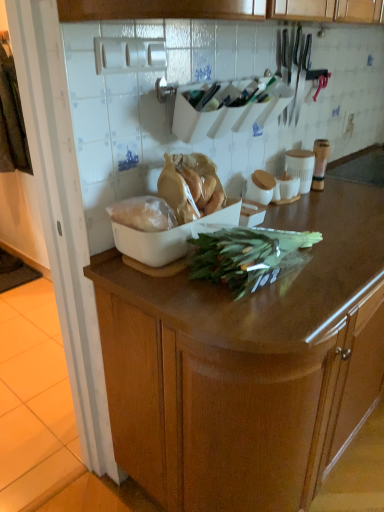
What do you see at coordinates (190, 186) in the screenshot? The width and height of the screenshot is (384, 512). I see `translucent plastic bag at center, the first food when ordered from right to left` at bounding box center [190, 186].

This screenshot has width=384, height=512. What are the coordinates of `green leafy at center` in the screenshot? It's located at (246, 256).

This screenshot has width=384, height=512. What do you see at coordinates (246, 256) in the screenshot? I see `green leafy at center` at bounding box center [246, 256].

Locate an element on the screen. This screenshot has height=512, width=384. white plastic bag at center, which ranks as the 1th food in left-to-right order is located at coordinates (143, 214).

The height and width of the screenshot is (512, 384). What are the coordinates of `wooden cabinet at center` in the screenshot? It's located at (247, 365).

Measure the distance between point (116,314) and camera.

The depth of point (116,314) is 3.71 feet.

Locate an element on the screen. This screenshot has width=384, height=512. translucent plastic bag at center, the first food when ordered from right to left is located at coordinates (190, 186).

What's the angular difference between wooden cabinet at center and translucent plastic bag at center, placed as the 2th food when sorted from left to right,'s facing directions?

There is a 1-degree angle between the facing directions of wooden cabinet at center and translucent plastic bag at center, placed as the 2th food when sorted from left to right.

Can you see wooden cabinet at center touching translucent plastic bag at center, placed as the 2th food when sorted from left to right?

wooden cabinet at center and translucent plastic bag at center, placed as the 2th food when sorted from left to right, are not in contact.

Which object is closer to the camera, wooden cabinet at center or translucent plastic bag at center, placed as the 2th food when sorted from left to right?

wooden cabinet at center is closer to the camera.

Can you confirm if wooden cabinet at center is positioned to the left of translucent plastic bag at center, placed as the 2th food when sorted from left to right?

In fact, wooden cabinet at center is to the right of translucent plastic bag at center, placed as the 2th food when sorted from left to right.

Consider the image. Is green leafy at center turned away from translucent plastic bag at center, placed as the 2th food when sorted from left to right?

Yes, translucent plastic bag at center, placed as the 2th food when sorted from left to right, is at the back of green leafy at center.

Is green leafy at center positioned behind translucent plastic bag at center, placed as the 2th food when sorted from left to right?

No, it is not.

From a real-world perspective, does green leafy at center stand above translucent plastic bag at center, the first food when ordered from right to left?

Incorrect, from a real-world perspective, green leafy at center is lower than translucent plastic bag at center, the first food when ordered from right to left.

Is white plastic bag at center, which ranks as the 1th food in left-to-right order, touching translucent plastic bag at center, placed as the 2th food when sorted from left to right?

Yes, white plastic bag at center, which ranks as the 1th food in left-to-right order, is beside translucent plastic bag at center, placed as the 2th food when sorted from left to right.

Identify the location of food above the white plastic bag at center, which ranks as the 1th food in left-to-right order (from a real-world perspective). (190, 186).

Which point is more distant from viewer, (139,198) or (178,160)?

The point (178,160) is more distant.

Can you confirm if white plastic bag at center, which is the 2th food in right-to-left order, is bigger than translucent plastic bag at center, placed as the 2th food when sorted from left to right?

Actually, white plastic bag at center, which is the 2th food in right-to-left order, might be smaller than translucent plastic bag at center, placed as the 2th food when sorted from left to right.

Is green leafy at center taller than white plastic bag at center, which ranks as the 1th food in left-to-right order?

Indeed, green leafy at center has a greater height compared to white plastic bag at center, which ranks as the 1th food in left-to-right order.

Is the depth of green leafy at center greater than that of white plastic bag at center, which ranks as the 1th food in left-to-right order?

No.

From the picture: Can you confirm if green leafy at center is wider than white plastic bag at center, which ranks as the 1th food in left-to-right order?

Correct, the width of green leafy at center exceeds that of white plastic bag at center, which ranks as the 1th food in left-to-right order.

From the picture: Is green leafy at center outside of white plastic bag at center, which ranks as the 1th food in left-to-right order?

Yes, green leafy at center is outside of white plastic bag at center, which ranks as the 1th food in left-to-right order.

Is translucent plastic bag at center, placed as the 2th food when sorted from left to right, spatially inside white plastic bag at center, which ranks as the 1th food in left-to-right order, or outside of it?

translucent plastic bag at center, placed as the 2th food when sorted from left to right, is located beyond the bounds of white plastic bag at center, which ranks as the 1th food in left-to-right order.

This screenshot has width=384, height=512. What are the coordinates of `food in front of the translucent plastic bag at center, placed as the 2th food when sorted from left to right` in the screenshot? It's located at (143, 214).

Can you confirm if translucent plastic bag at center, placed as the 2th food when sorted from left to right, is positioned to the left of white plastic bag at center, which is the 2th food in right-to-left order?

In fact, translucent plastic bag at center, placed as the 2th food when sorted from left to right, is to the right of white plastic bag at center, which is the 2th food in right-to-left order.

From a real-world perspective, is translucent plastic bag at center, placed as the 2th food when sorted from left to right, positioned above or below white plastic bag at center, which is the 2th food in right-to-left order?

In terms of real-world spatial position, translucent plastic bag at center, placed as the 2th food when sorted from left to right, is above white plastic bag at center, which is the 2th food in right-to-left order.

Is green leafy at center facing away from wooden cabinet at center?

No, green leafy at center is not facing away from wooden cabinet at center.

Does point (310, 241) come in front of point (107, 366)?

That is True.

Can you tell me how much green leafy at center and wooden cabinet at center differ in facing direction?

There is a 0.000624-degree angle between the facing directions of green leafy at center and wooden cabinet at center.

The image size is (384, 512). Find the location of `green vegetables behind the wooden cabinet at center`. green vegetables behind the wooden cabinet at center is located at coordinates (246, 256).

Is white plastic bag at center, which ranks as the 1th food in left-to-right order, located outside wooden cabinet at center?

white plastic bag at center, which ranks as the 1th food in left-to-right order, is positioned outside wooden cabinet at center.

From the image's perspective, is white plastic bag at center, which ranks as the 1th food in left-to-right order, above wooden cabinet at center?

Yes, from the image's perspective, white plastic bag at center, which ranks as the 1th food in left-to-right order, is on top of wooden cabinet at center.

From a real-world perspective, is white plastic bag at center, which ranks as the 1th food in left-to-right order, over wooden cabinet at center?

Yes, from a real-world perspective, white plastic bag at center, which ranks as the 1th food in left-to-right order, is over wooden cabinet at center

Can you confirm if white plastic bag at center, which ranks as the 1th food in left-to-right order, is positioned to the right of wooden cabinet at center?

Incorrect, white plastic bag at center, which ranks as the 1th food in left-to-right order, is not on the right side of wooden cabinet at center.

Locate an element on the screen. Image resolution: width=384 pixels, height=512 pixels. cabinetry on the right of translucent plastic bag at center, placed as the 2th food when sorted from left to right is located at coordinates (247, 365).

Image resolution: width=384 pixels, height=512 pixels. In order to click on the 2nd food positioned above the green leafy at center (from a real-world perspective) in this screenshot , I will do `click(190, 186)`.

Considering their positions, is translucent plastic bag at center, placed as the 2th food when sorted from left to right, positioned further to wooden cabinet at center than green leafy at center?

Among the two, translucent plastic bag at center, placed as the 2th food when sorted from left to right, is located further to wooden cabinet at center.

Considering their positions, is wooden cabinet at center positioned further to white plastic bag at center, which is the 2th food in right-to-left order, than translucent plastic bag at center, the first food when ordered from right to left?

The object further to white plastic bag at center, which is the 2th food in right-to-left order, is wooden cabinet at center.

Estimate the real-world distances between objects in this image. Which object is further from translucent plastic bag at center, the first food when ordered from right to left, wooden cabinet at center or green leafy at center?

Based on the image, wooden cabinet at center appears to be further to translucent plastic bag at center, the first food when ordered from right to left.

Based on their spatial positions, is translucent plastic bag at center, placed as the 2th food when sorted from left to right, or white plastic bag at center, which is the 2th food in right-to-left order, closer to wooden cabinet at center?

The object closer to wooden cabinet at center is translucent plastic bag at center, placed as the 2th food when sorted from left to right.

Which object lies further to the anchor point wooden cabinet at center, white plastic bag at center, which ranks as the 1th food in left-to-right order, or translucent plastic bag at center, the first food when ordered from right to left?

Based on the image, white plastic bag at center, which ranks as the 1th food in left-to-right order, appears to be further to wooden cabinet at center.

Which object lies further to the anchor point green leafy at center, white plastic bag at center, which ranks as the 1th food in left-to-right order, or translucent plastic bag at center, the first food when ordered from right to left?

white plastic bag at center, which ranks as the 1th food in left-to-right order, is positioned further to the anchor green leafy at center.

Estimate the real-world distances between objects in this image. Which object is closer to white plastic bag at center, which is the 2th food in right-to-left order, translucent plastic bag at center, placed as the 2th food when sorted from left to right, or wooden cabinet at center?

translucent plastic bag at center, placed as the 2th food when sorted from left to right.

Looking at the image, which one is located further to translucent plastic bag at center, the first food when ordered from right to left, white plastic bag at center, which ranks as the 1th food in left-to-right order, or wooden cabinet at center?

wooden cabinet at center is positioned further to the anchor translucent plastic bag at center, the first food when ordered from right to left.

Find the location of `food between white plastic bag at center, which ranks as the 1th food in left-to-right order, and wooden cabinet at center, in the horizontal direction`. food between white plastic bag at center, which ranks as the 1th food in left-to-right order, and wooden cabinet at center, in the horizontal direction is located at coordinates (190, 186).

In order to click on food situated between white plastic bag at center, which ranks as the 1th food in left-to-right order, and green leafy at center from left to right in this screenshot , I will do `click(190, 186)`.

This screenshot has height=512, width=384. I want to click on green vegetables between translucent plastic bag at center, the first food when ordered from right to left, and wooden cabinet at center from left to right, so click(x=246, y=256).

Where is `green vegetables situated between white plastic bag at center, which ranks as the 1th food in left-to-right order, and wooden cabinet at center from left to right`? green vegetables situated between white plastic bag at center, which ranks as the 1th food in left-to-right order, and wooden cabinet at center from left to right is located at coordinates (246, 256).